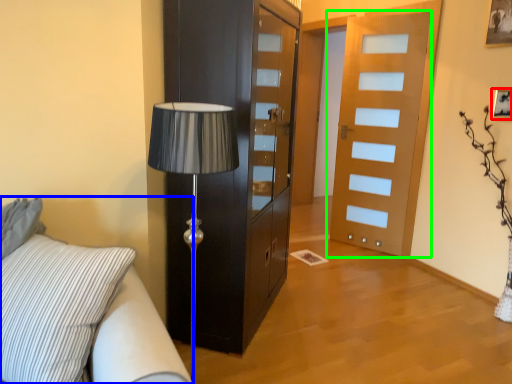
Question: Which is farther away from picture frame (highlighted by a red box)? studio couch (highlighted by a blue box) or door (highlighted by a green box)?

Choices:
 (A) studio couch
 (B) door

Answer: (A)